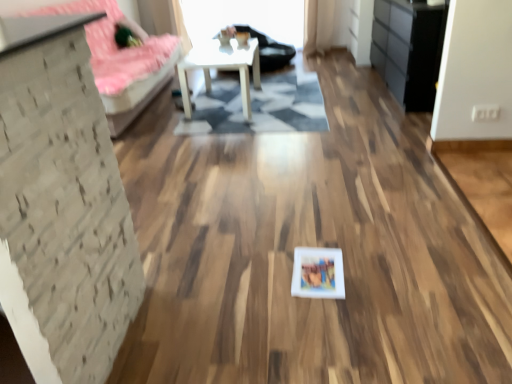
Question: Is white fabric couch at left taller or shorter than matte white picture frame at center?

Choices:
 (A) tall
 (B) short

Answer: (A)

Question: Is point (93, 51) closer or farther from the camera than point (295, 283)?

Choices:
 (A) closer
 (B) farther

Answer: (B)

Question: Which of these objects is positioned farthest from the geometric rug at center?

Choices:
 (A) black matte dresser at right
 (B) matte white picture frame at center
 (C) white matte table at center
 (D) white fabric couch at left

Answer: (B)

Question: Which object is the closest to the geometric rug at center?

Choices:
 (A) white fabric couch at left
 (B) matte white picture frame at center
 (C) black matte dresser at right
 (D) white matte table at center

Answer: (D)